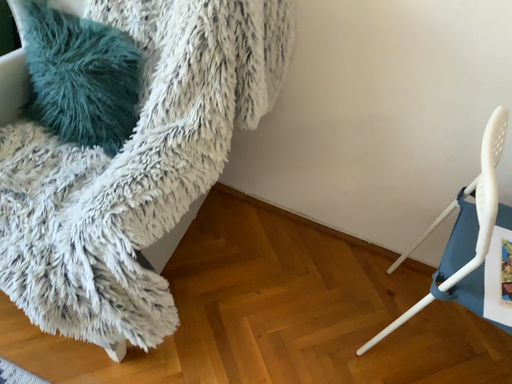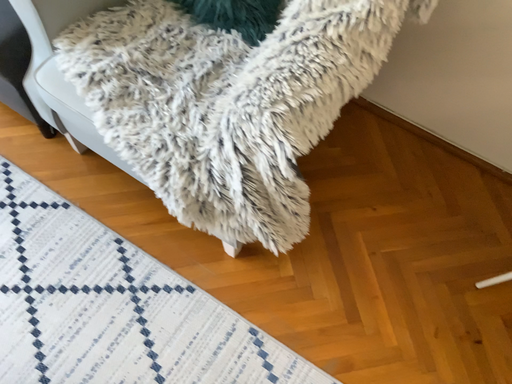
Question: How did the camera likely rotate when shooting the video?

Choices:
 (A) rotated downward
 (B) rotated upward

Answer: (A)